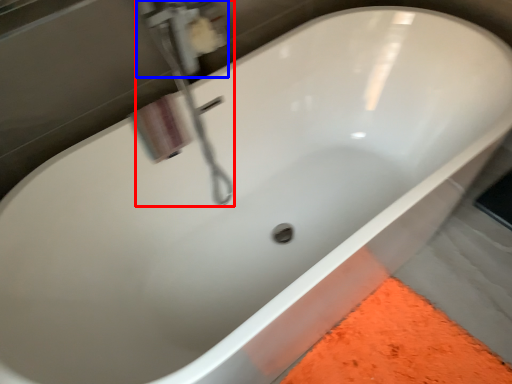
Question: Which object appears farthest to the camera in this image, plumbing fixture (highlighted by a red box) or plumbing fixture (highlighted by a blue box)?

Choices:
 (A) plumbing fixture
 (B) plumbing fixture

Answer: (B)